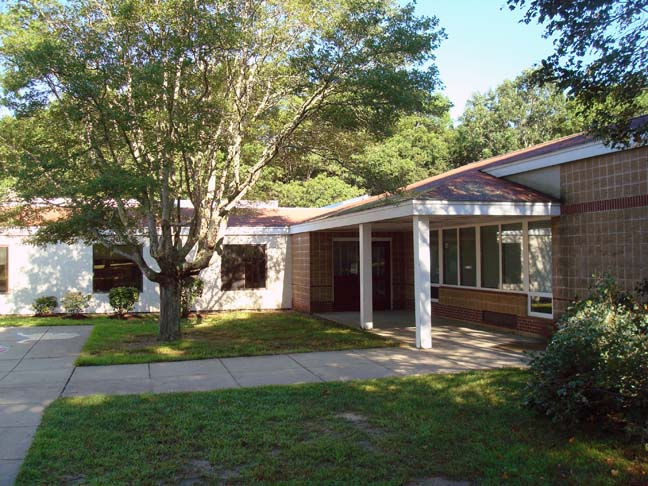
Where is `door`? This screenshot has height=486, width=648. door is located at coordinates (343, 276), (374, 279).